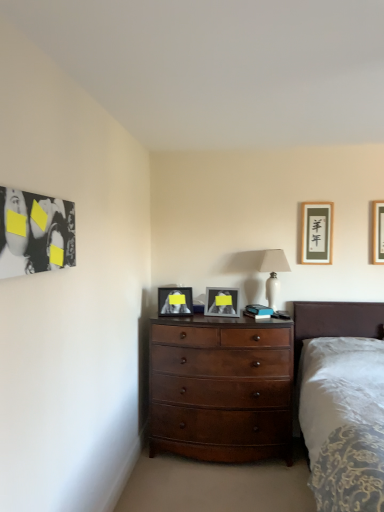
Question: Which direction should I rotate to look at matte gray picture frame at center, which is the 2th picture frame in left-to-right order, — up or down?

Choices:
 (A) down
 (B) up

Answer: (A)

Question: From a real-world perspective, is mahogany wood dresser at center located beneath white ceramic lamp at upper center?

Choices:
 (A) yes
 (B) no

Answer: (A)

Question: Is white ceramic lamp at upper center inside mahogany wood dresser at center?

Choices:
 (A) yes
 (B) no

Answer: (B)

Question: Is mahogany wood dresser at center facing away from white ceramic lamp at upper center?

Choices:
 (A) yes
 (B) no

Answer: (B)

Question: From a real-world perspective, is mahogany wood dresser at center physically above white ceramic lamp at upper center?

Choices:
 (A) yes
 (B) no

Answer: (B)

Question: Is mahogany wood dresser at center further to camera compared to white ceramic lamp at upper center?

Choices:
 (A) yes
 (B) no

Answer: (B)

Question: Is mahogany wood dresser at center taller than white ceramic lamp at upper center?

Choices:
 (A) no
 (B) yes

Answer: (B)

Question: Is matte black picture frame at center, the 1th picture frame in the left-to-right sequence, at the left side of wooden picture frame at upper right, marked as the 1th picture frame in a right-to-left arrangement?

Choices:
 (A) yes
 (B) no

Answer: (A)

Question: Is matte black picture frame at center, the 1th picture frame in the left-to-right sequence, outside wooden picture frame at upper right, marked as the 1th picture frame in a right-to-left arrangement?

Choices:
 (A) no
 (B) yes

Answer: (B)

Question: Could you tell me if matte black picture frame at center, which is the fourth picture frame in right-to-left order, is turned towards wooden picture frame at upper right, marked as the 1th picture frame in a right-to-left arrangement?

Choices:
 (A) yes
 (B) no

Answer: (B)

Question: From the image's perspective, is matte black picture frame at center, the 1th picture frame in the left-to-right sequence, above wooden picture frame at upper right, the fourth picture frame in the left-to-right sequence?

Choices:
 (A) yes
 (B) no

Answer: (B)

Question: Can you confirm if matte black picture frame at center, the 1th picture frame in the left-to-right sequence, is positioned to the right of wooden picture frame at upper right, marked as the 1th picture frame in a right-to-left arrangement?

Choices:
 (A) yes
 (B) no

Answer: (B)

Question: Is matte black picture frame at center, the 1th picture frame in the left-to-right sequence, thinner than wooden picture frame at upper right, the fourth picture frame in the left-to-right sequence?

Choices:
 (A) no
 (B) yes

Answer: (A)

Question: Considering the relative sizes of white ceramic lamp at upper center and matte black picture frame at upper right, the 3th picture frame when ordered from left to right, in the image provided, is white ceramic lamp at upper center smaller than matte black picture frame at upper right, the 3th picture frame when ordered from left to right,?

Choices:
 (A) no
 (B) yes

Answer: (A)